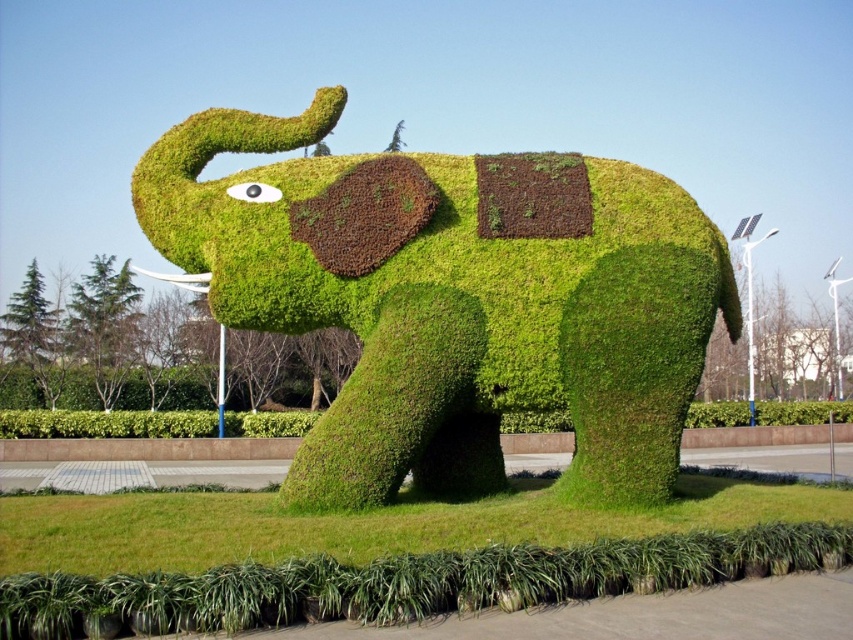
Question: Considering the relative positions of green grassy elephant at center and green grass at lower center in the image provided, where is green grassy elephant at center located with respect to green grass at lower center?

Choices:
 (A) below
 (B) above

Answer: (B)

Question: Does green grassy elephant at center appear over green grass at lower center?

Choices:
 (A) yes
 (B) no

Answer: (A)

Question: Among these points, which one is nearest to the camera?

Choices:
 (A) [744, 515]
 (B) [587, 157]

Answer: (A)

Question: Can you confirm if green grassy elephant at center is positioned below green grass at lower center?

Choices:
 (A) no
 (B) yes

Answer: (A)